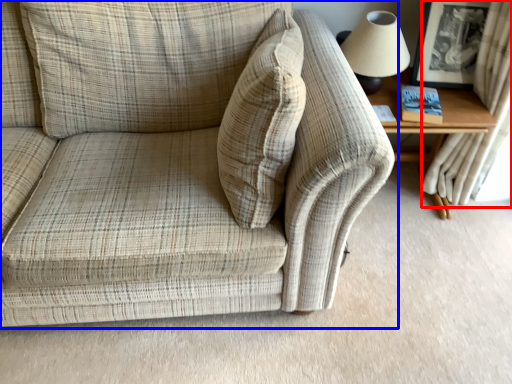
Question: Among these objects, which one is nearest to the camera, curtain (highlighted by a red box) or studio couch (highlighted by a blue box)?

Choices:
 (A) curtain
 (B) studio couch

Answer: (B)